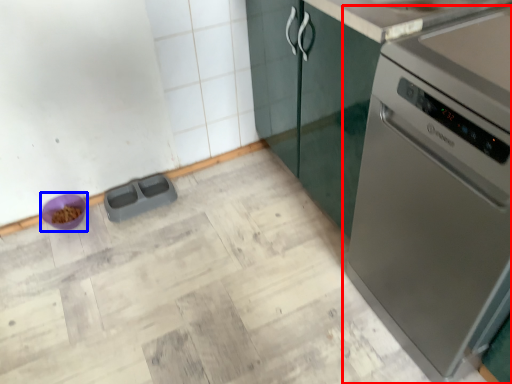
Question: Which point is further to the camera, home appliance (highlighted by a red box) or appliance (highlighted by a blue box)?

Choices:
 (A) home appliance
 (B) appliance

Answer: (B)